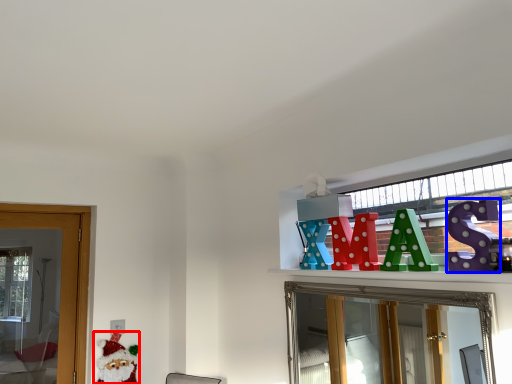
Question: Which point is closer to the camera, santa claus (highlighted by a red box) or toy (highlighted by a blue box)?

Choices:
 (A) santa claus
 (B) toy

Answer: (B)